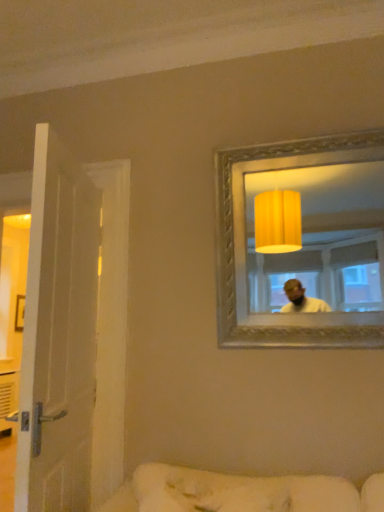
Question: Does white fabric couch at lower center have a lesser width compared to gold textured mirror at upper right?

Choices:
 (A) yes
 (B) no

Answer: (B)

Question: Is gold textured mirror at upper right at the back of white fabric couch at lower center?

Choices:
 (A) no
 (B) yes

Answer: (A)

Question: From a real-world perspective, is white fabric couch at lower center physically below gold textured mirror at upper right?

Choices:
 (A) no
 (B) yes

Answer: (B)

Question: Is white fabric couch at lower center far away from gold textured mirror at upper right?

Choices:
 (A) no
 (B) yes

Answer: (B)

Question: Does white fabric couch at lower center lie behind gold textured mirror at upper right?

Choices:
 (A) yes
 (B) no

Answer: (B)

Question: Based on their sizes in the image, would you say white wooden door at left is bigger or smaller than gold textured mirror at upper right?

Choices:
 (A) big
 (B) small

Answer: (A)

Question: Is point tap(82, 315) closer or farther from the camera than point tap(347, 216)?

Choices:
 (A) farther
 (B) closer

Answer: (B)

Question: From the image's perspective, is white wooden door at left located above or below gold textured mirror at upper right?

Choices:
 (A) below
 (B) above

Answer: (A)

Question: Would you say white wooden door at left is to the left or to the right of gold textured mirror at upper right in the picture?

Choices:
 (A) right
 (B) left

Answer: (B)

Question: From the image's perspective, relative to white wooden door at left, is gold textured mirror at upper right above or below?

Choices:
 (A) below
 (B) above

Answer: (B)

Question: Considering the positions of point (269, 286) and point (34, 328), is point (269, 286) closer or farther from the camera than point (34, 328)?

Choices:
 (A) farther
 (B) closer

Answer: (A)

Question: Is gold textured mirror at upper right taller or shorter than white wooden door at left?

Choices:
 (A) tall
 (B) short

Answer: (B)

Question: From a real-world perspective, relative to white wooden door at left, is gold textured mirror at upper right vertically above or below?

Choices:
 (A) above
 (B) below

Answer: (A)

Question: Considering the positions of gold textured mirror at upper right and white fabric couch at lower center in the image, is gold textured mirror at upper right taller or shorter than white fabric couch at lower center?

Choices:
 (A) tall
 (B) short

Answer: (A)

Question: Does point (334, 177) appear closer or farther from the camera than point (296, 510)?

Choices:
 (A) closer
 (B) farther

Answer: (B)